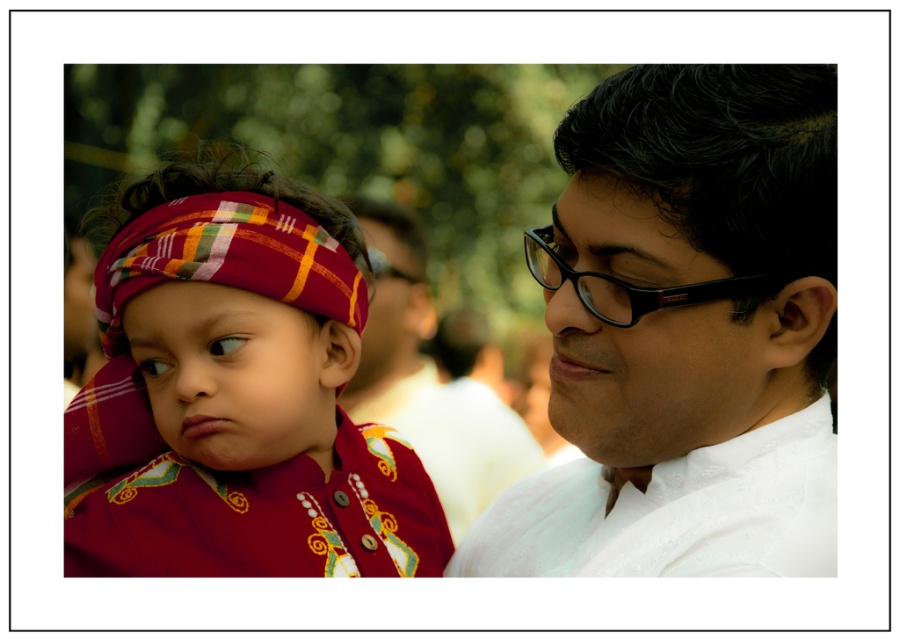
Question: Can you confirm if matte fabric turban at left is positioned below black plastic glasses at center?

Choices:
 (A) yes
 (B) no

Answer: (A)

Question: Which point appears closest to the camera in this image?

Choices:
 (A) (666, 292)
 (B) (459, 540)

Answer: (A)

Question: Considering the real-world distances, which object is closest to the black plastic glasses at center?

Choices:
 (A) matte fabric forehead at center
 (B) white matte shirt at right

Answer: (B)

Question: Can you confirm if matte fabric turban at left is positioned above black plastic glasses at right?

Choices:
 (A) no
 (B) yes

Answer: (A)

Question: Can you confirm if white matte shirt at right is smaller than black plastic glasses at right?

Choices:
 (A) no
 (B) yes

Answer: (A)

Question: Which point is farther to the camera?

Choices:
 (A) black plastic glasses at right
 (B) black plastic glasses at center
 (C) white matte shirt at right

Answer: (B)